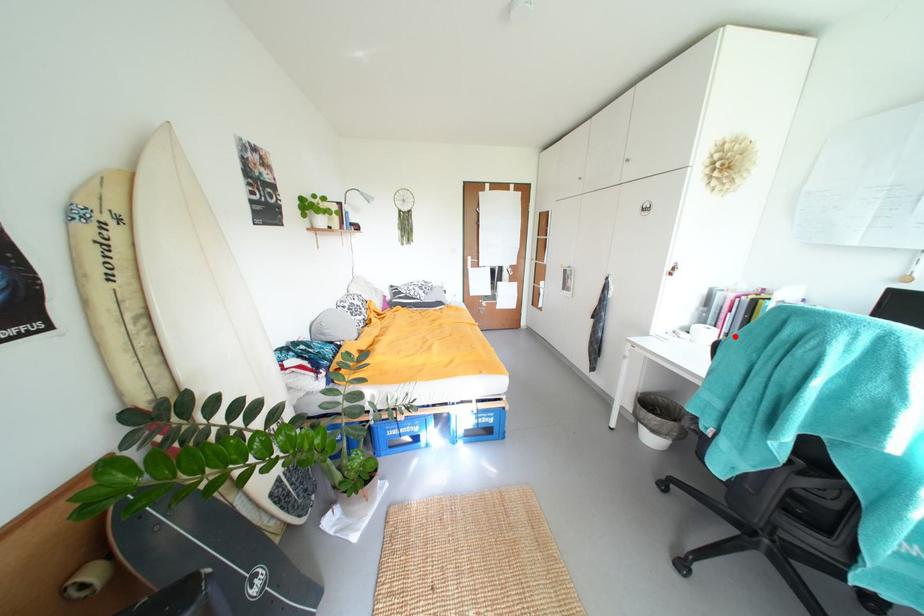
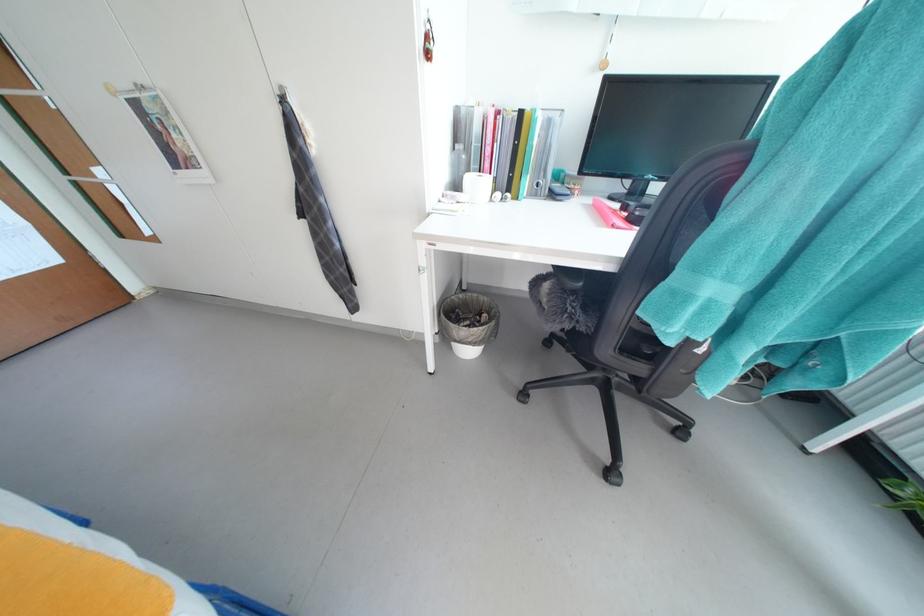
Locate, in the second image, the point that corresponds to the highlighted location in the first image.

(503, 182)